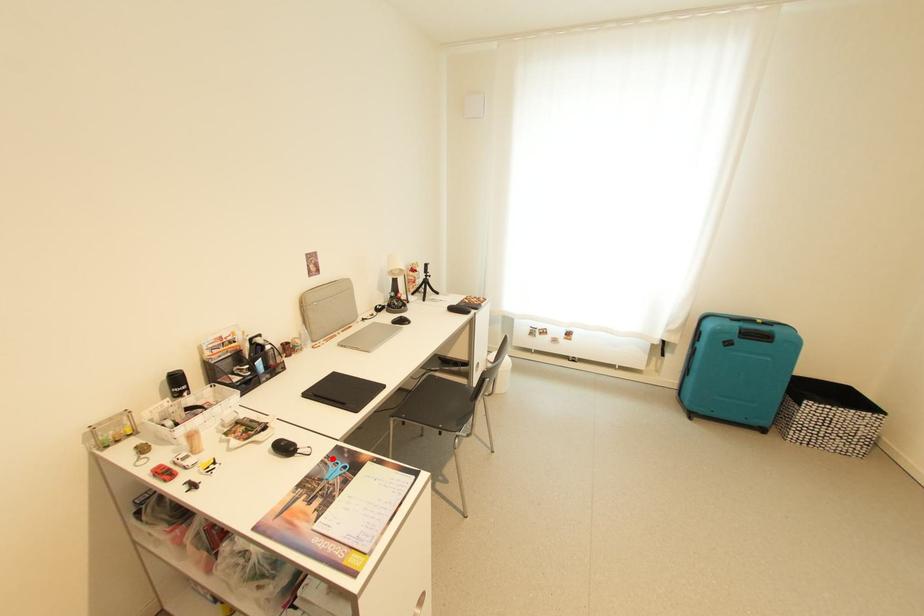
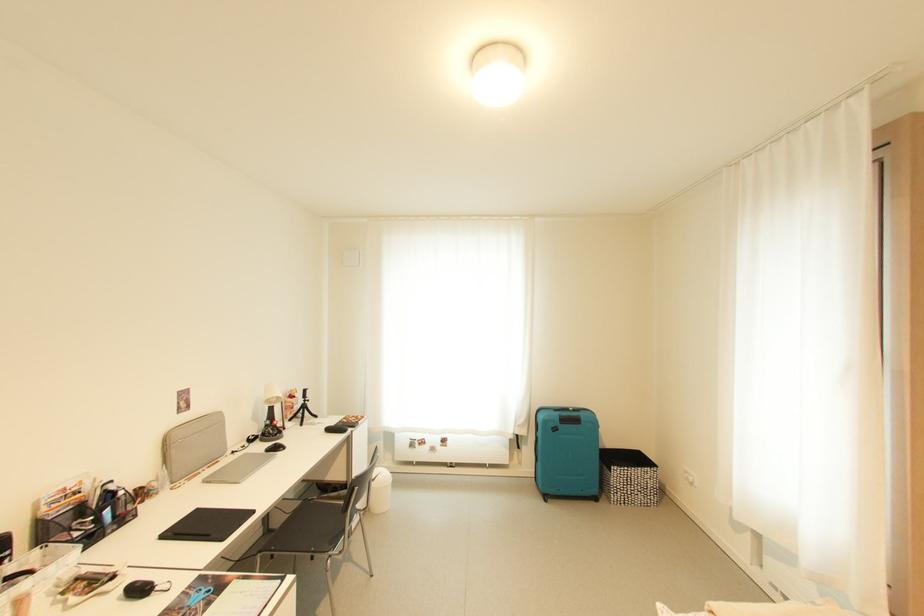
Find the pixel in the second image that matches the highlighted location in the first image.

(195, 589)